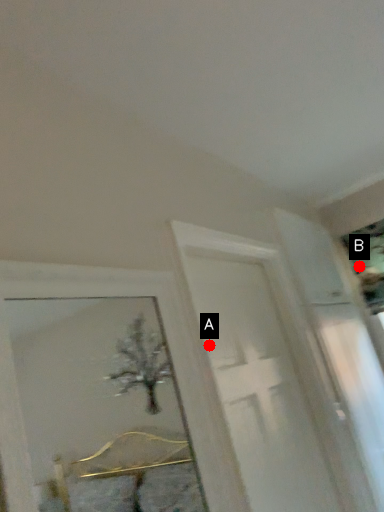
Question: Two points are circled on the image, labeled by A and B beside each circle. Which point is closer to the camera?

Choices:
 (A) A is closer
 (B) B is closer

Answer: (A)